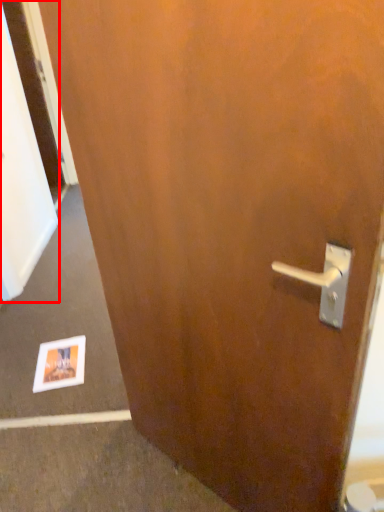
Question: Considering the relative positions of screen door (annotated by the red box) and postcard in the image provided, where is screen door (annotated by the red box) located with respect to the staircase?

Choices:
 (A) left
 (B) right

Answer: (A)